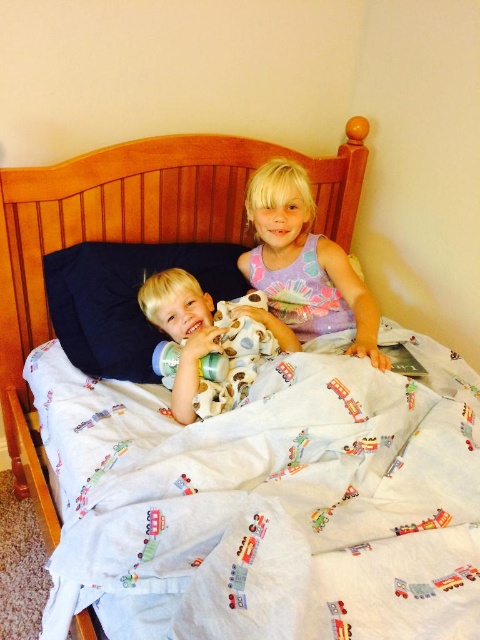
You are a photographer standing in front of the bed. You want to take a photo of the two children while ensuring that both points remain visible in the frame. Given that point A is at coordinates point (333, 285) and point B is at coordinates point (194, 298), which point should you position closer to the camera to ensure both points stay in the frame?

Since point A at coordinates point (333, 285) is behind point B at coordinates point (194, 298), positioning point B closer to the camera will ensure both points remain visible in the frame.